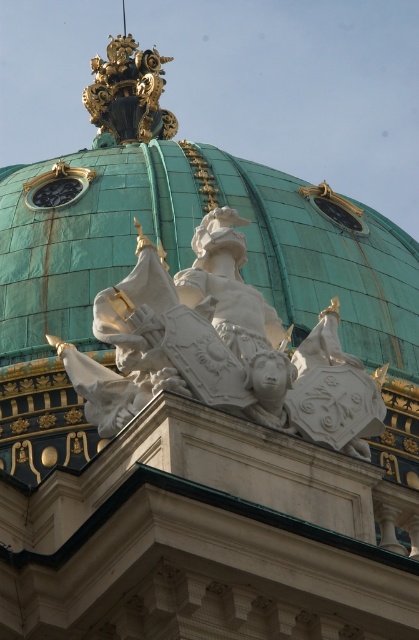
Is white stone statue at center below gold metallic clock at upper center?

Yes.

Is point (114, 396) less distant than point (38, 193)?

Yes.

The height and width of the screenshot is (640, 419). I want to click on white stone statue at center, so coord(220,348).

Can you confirm if green copper dome at center is smaller than white stone statue at center?

No.

Measure the distance between point (85,150) and camera.

322.27 feet

Where is `green copper dome at center`? green copper dome at center is located at coordinates (87, 240).

Consider the image. Who is more distant from viewer, (160, 148) or (38, 195)?

Positioned behind is point (160, 148).

Does point (289, 236) come in front of point (59, 189)?

Yes, it is in front of point (59, 189).

Where is `green copper dome at center`? green copper dome at center is located at coordinates (87, 240).